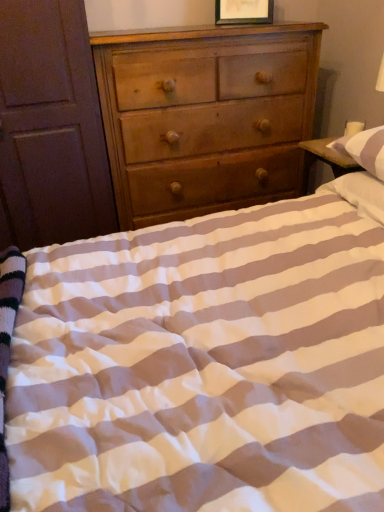
Question: Is brown wooden armoire at left outside of light brown wood chest of drawers at center?

Choices:
 (A) yes
 (B) no

Answer: (A)

Question: Is light brown wood chest of drawers at center located within brown wooden armoire at left?

Choices:
 (A) yes
 (B) no

Answer: (B)

Question: Does brown wooden armoire at left lie in front of light brown wood chest of drawers at center?

Choices:
 (A) no
 (B) yes

Answer: (B)

Question: Could you tell me if brown wooden armoire at left is turned towards light brown wood chest of drawers at center?

Choices:
 (A) yes
 (B) no

Answer: (B)

Question: Is brown wooden armoire at left positioned far away from light brown wood chest of drawers at center?

Choices:
 (A) no
 (B) yes

Answer: (A)

Question: From a real-world perspective, is wooden picture frame at upper center above or below light brown wood chest of drawers at center?

Choices:
 (A) above
 (B) below

Answer: (A)

Question: Is wooden picture frame at upper center bigger or smaller than light brown wood chest of drawers at center?

Choices:
 (A) small
 (B) big

Answer: (A)

Question: Is wooden picture frame at upper center in front of or behind light brown wood chest of drawers at center in the image?

Choices:
 (A) front
 (B) behind

Answer: (B)

Question: From the image's perspective, is wooden picture frame at upper center located above or below light brown wood chest of drawers at center?

Choices:
 (A) above
 (B) below

Answer: (A)

Question: Is point (286, 119) closer or farther from the camera than point (23, 163)?

Choices:
 (A) closer
 (B) farther

Answer: (B)

Question: In terms of height, does light brown wood chest of drawers at center look taller or shorter compared to brown wooden armoire at left?

Choices:
 (A) tall
 (B) short

Answer: (B)

Question: Is light brown wood chest of drawers at center in front of or behind brown wooden armoire at left in the image?

Choices:
 (A) behind
 (B) front

Answer: (A)

Question: In terms of size, does light brown wood chest of drawers at center appear bigger or smaller than brown wooden armoire at left?

Choices:
 (A) small
 (B) big

Answer: (B)

Question: From the image's perspective, is wooden picture frame at upper center located above or below brown wooden armoire at left?

Choices:
 (A) below
 (B) above

Answer: (B)

Question: From a real-world perspective, relative to brown wooden armoire at left, is wooden picture frame at upper center vertically above or below?

Choices:
 (A) above
 (B) below

Answer: (A)